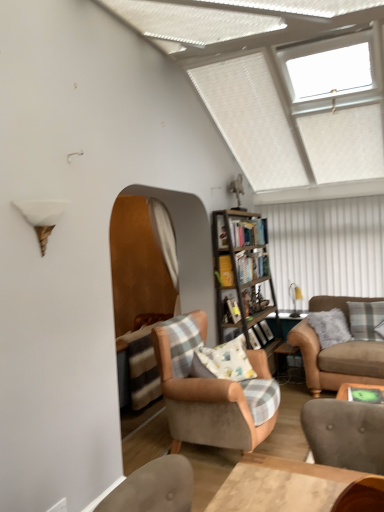
Image resolution: width=384 pixels, height=512 pixels. Describe the element at coordinates (223, 361) in the screenshot. I see `fluffy cotton pillow at center, the 1th pillow positioned from the front` at that location.

You are a GUI agent. You are given a task and a screenshot of the screen. Output one action in this format:
    pyautogui.click(x=<x>, y=<y>)
    Task: Click on the wooden bookshelf at center
    The height and width of the screenshot is (512, 384).
    Given the screenshot: What is the action you would take?
    pyautogui.click(x=243, y=275)

This screenshot has height=512, width=384. What do you see at coordinates (243, 275) in the screenshot? I see `wooden bookshelf at center` at bounding box center [243, 275].

Describe the element at coordinates (206, 407) in the screenshot. I see `velvet beige armchair at center` at that location.

Measure the distance between point [370,85] and camera.

3.59 meters.

Locate an element on the screen. orange fabric curtain at center is located at coordinates (164, 238).

Locate an element on the screen. white striped shutter at upper right is located at coordinates (327, 248).

The width and height of the screenshot is (384, 512). In order to click on fluffy cotton pillow at center, the 2th pillow positioned from the back in this screenshot , I will do (223, 361).

Looking at the image, does orange fabric curtain at center seem bigger or smaller compared to wooden bookshelf at center?

Considering their sizes, orange fabric curtain at center takes up more space than wooden bookshelf at center.

From the image's perspective, between orange fabric curtain at center and wooden bookshelf at center, which one is located above?

orange fabric curtain at center appears higher in the image.

From a real-world perspective, is orange fabric curtain at center located higher than wooden bookshelf at center?

Yes.

Can you see orange fabric curtain at center touching wooden bookshelf at center?

No, orange fabric curtain at center is not with wooden bookshelf at center.

In the image, is wooden bookshelf at center positioned in front of or behind white striped shutter at upper right?

In the image, wooden bookshelf at center appears in front of white striped shutter at upper right.

Locate an element on the screen. This screenshot has height=512, width=384. shelf below the white striped shutter at upper right (from the image's perspective) is located at coordinates (251, 265).

Between wooden bookshelf at center and white striped shutter at upper right, which one has smaller size?

wooden bookshelf at center.

Considering the points (245, 271) and (369, 293), which point is in front, point (245, 271) or point (369, 293)?

The point (245, 271) is more forward.

Is metallic silver side table at lower right facing away from orange fabric curtain at center?

metallic silver side table at lower right does not have its back to orange fabric curtain at center.

From their relative heights in the image, would you say metallic silver side table at lower right is taller or shorter than orange fabric curtain at center?

Considering their sizes, metallic silver side table at lower right has less height than orange fabric curtain at center.

From a real-world perspective, is metallic silver side table at lower right located beneath orange fabric curtain at center?

Indeed, from a real-world perspective, metallic silver side table at lower right is positioned beneath orange fabric curtain at center.

What's the angular difference between wooden bookshelf at center and velvet beige armchair at center's facing directions?

wooden bookshelf at center and velvet beige armchair at center are facing 0.907 degrees away from each other.

From the image's perspective, is wooden bookshelf at center beneath velvet beige armchair at center?

No, from the image's perspective, wooden bookshelf at center is not below velvet beige armchair at center.

In the scene shown: Can you see wooden bookshelf at center touching velvet beige armchair at center?

wooden bookshelf at center and velvet beige armchair at center are clearly separated.

In terms of width, does wooden bookshelf at center look wider or thinner when compared to velvet beige armchair at center?

Clearly, wooden bookshelf at center has less width compared to velvet beige armchair at center.

Is white plastic window at upper right with wooden bookshelf at center?

No, white plastic window at upper right is not with wooden bookshelf at center.

Considering the relative positions of white plastic window at upper right and wooden bookshelf at center in the image provided, is white plastic window at upper right to the left of wooden bookshelf at center from the viewer's perspective?

No, white plastic window at upper right is not to the left of wooden bookshelf at center.

Considering the positions of point (317, 68) and point (252, 263), is point (317, 68) closer or farther from the camera than point (252, 263)?

Point (317, 68) appears to be closer to the viewer than point (252, 263).

From a real-world perspective, is white plastic window at upper right positioned under wooden bookshelf at center based on gravity?

Actually, white plastic window at upper right is physically above wooden bookshelf at center in the real world.

Is suede brown couch at right located outside fluffy cotton pillow at center, which is counted as the first pillow, starting from the left?

Absolutely, suede brown couch at right is external to fluffy cotton pillow at center, which is counted as the first pillow, starting from the left.

Is suede brown couch at right facing away from fluffy cotton pillow at center, the 1th pillow positioned from the front?

No, suede brown couch at right is not facing away from fluffy cotton pillow at center, the 1th pillow positioned from the front.

From the picture: Considering the sizes of objects suede brown couch at right and fluffy cotton pillow at center, the 2th pillow positioned from the back, in the image provided, who is shorter, suede brown couch at right or fluffy cotton pillow at center, the 2th pillow positioned from the back,?

fluffy cotton pillow at center, the 2th pillow positioned from the back, is shorter.

Is white plastic window at upper right touching wooden bookshelf at center?

No, white plastic window at upper right is not in contact with wooden bookshelf at center.

Does white plastic window at upper right have a smaller size compared to wooden bookshelf at center?

Yes, white plastic window at upper right is smaller than wooden bookshelf at center.

From a real-world perspective, is white plastic window at upper right physically below wooden bookshelf at center?

No, from a real-world perspective, white plastic window at upper right is not beneath wooden bookshelf at center.

In terms of width, does white plastic window at upper right look wider or thinner when compared to wooden bookshelf at center?

In the image, white plastic window at upper right appears to be wider than wooden bookshelf at center.

The width and height of the screenshot is (384, 512). Find the location of `curtain that is above the wooden bookshelf at center (from a real-world perspective)`. curtain that is above the wooden bookshelf at center (from a real-world perspective) is located at coordinates (164, 238).

The height and width of the screenshot is (512, 384). I want to click on shutter located on the right of wooden bookshelf at center, so click(327, 248).

Consider the image. Considering their positions, is wooden bookshelf at center positioned further to fluffy cotton pillow at center, the 2th pillow positioned from the back, than wooden bookshelf at center?

wooden bookshelf at center is positioned further to the anchor fluffy cotton pillow at center, the 2th pillow positioned from the back.

Estimate the real-world distances between objects in this image. Which object is further from wooden bookshelf at center, metallic silver side table at lower right or green felt table at lower right?

Among the two, green felt table at lower right is located further to wooden bookshelf at center.

When comparing their distances from white striped shutter at upper right, does fluffy cotton pillow at center, the 2th pillow positioned from the back, or orange fabric curtain at center seem closer?

Among the two, orange fabric curtain at center is located nearer to white striped shutter at upper right.

Estimate the real-world distances between objects in this image. Which object is further from wooden bookshelf at center, orange fabric curtain at center or velvet beige armchair at center?

velvet beige armchair at center lies further to wooden bookshelf at center than the other object.

Based on their spatial positions, is gray plaid pillow at right, arranged as the first pillow when viewed from the right, or white striped shutter at upper right closer to suede brown couch at right?

gray plaid pillow at right, arranged as the first pillow when viewed from the right, is closer to suede brown couch at right.

When comparing their distances from wooden bookshelf at center, does green felt table at lower right or wooden bookshelf at center seem further?

The object further to wooden bookshelf at center is green felt table at lower right.

Estimate the real-world distances between objects in this image. Which object is further from white plastic window at upper right, orange fabric curtain at center or velvet beige armchair at center?

Based on the image, velvet beige armchair at center appears to be further to white plastic window at upper right.

Estimate the real-world distances between objects in this image. Which object is further from metallic silver side table at lower right, gray plaid pillow at right, the second pillow in the left-to-right sequence, or green felt table at lower right?

The object further to metallic silver side table at lower right is green felt table at lower right.

In order to click on shelf between fluffy cotton pillow at center, which is counted as the first pillow, starting from the left, and gray plaid pillow at right, which ranks as the first pillow in back-to-front order, in the horizontal direction in this screenshot , I will do `click(251, 265)`.

I want to click on shelf between orange fabric curtain at center and wooden bookshelf at center, so click(x=251, y=265).

Where is `shutter that lies between white plastic window at upper right and wooden bookshelf at center from top to bottom`? Image resolution: width=384 pixels, height=512 pixels. shutter that lies between white plastic window at upper right and wooden bookshelf at center from top to bottom is located at coordinates (327, 248).

Find the location of `bookcase positioned between green felt table at lower right and wooden bookshelf at center from near to far`. bookcase positioned between green felt table at lower right and wooden bookshelf at center from near to far is located at coordinates (243, 275).